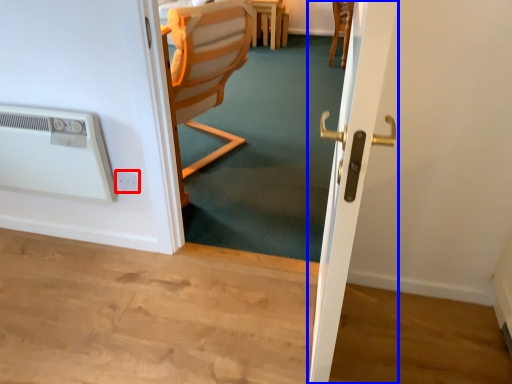
Question: Which of the following is the farthest to the observer, electric outlet (highlighted by a red box) or screen door (highlighted by a blue box)?

Choices:
 (A) electric outlet
 (B) screen door

Answer: (A)